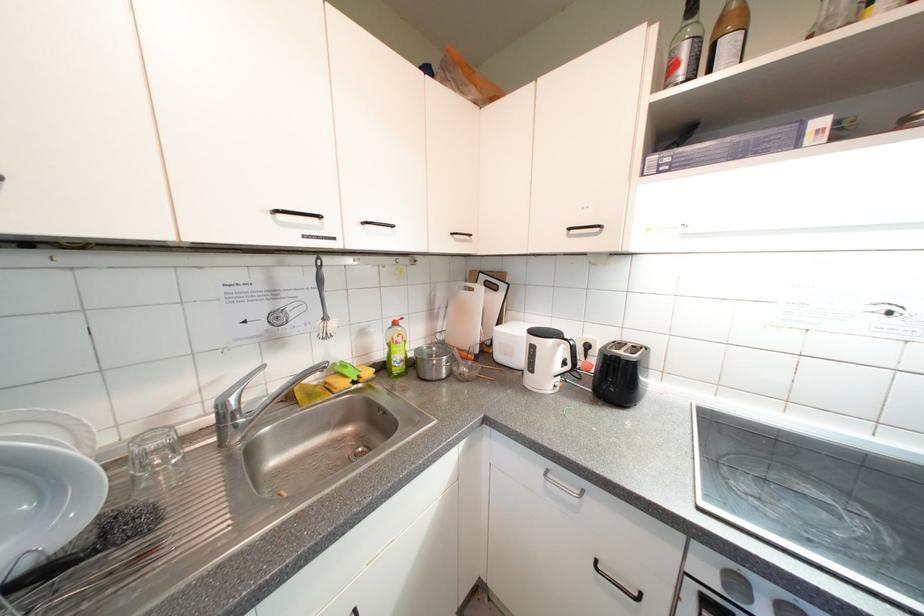
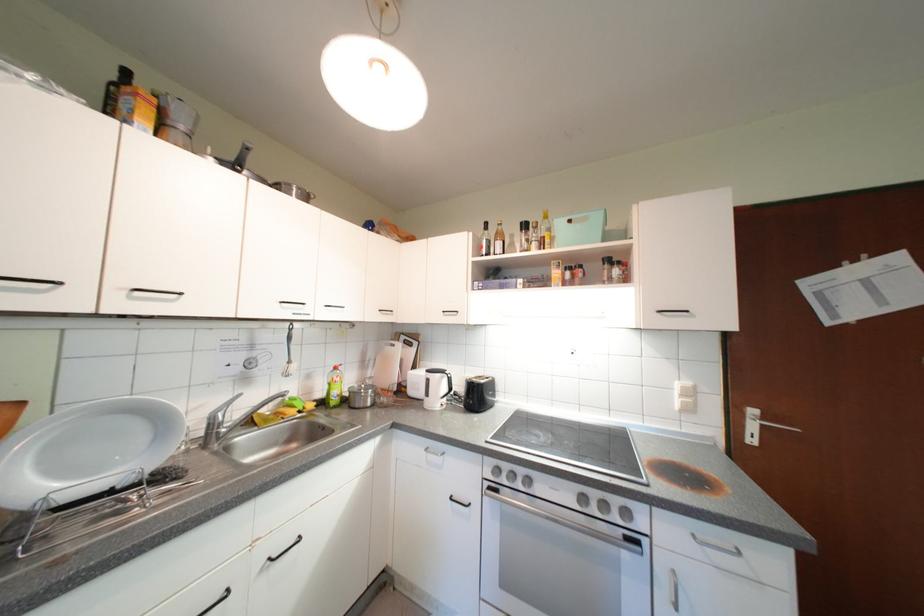
In the second image, find the point that corresponds to (x=285, y=214) in the first image.

(292, 305)